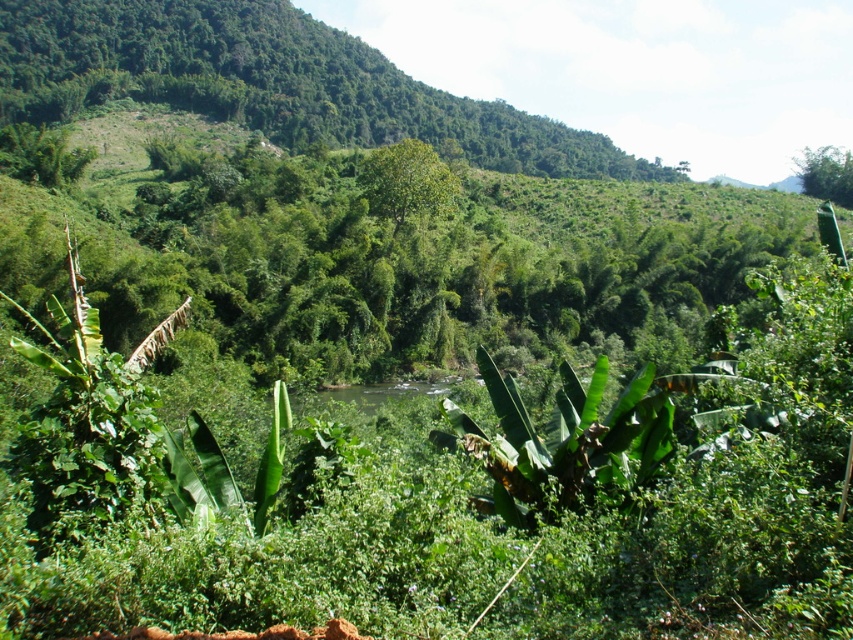
Is point (598, 465) farther from camera compared to point (440, 168)?

No, (598, 465) is closer to viewer.

The image size is (853, 640). Identify the location of green leafy banana tree at center. (564, 444).

Which is below, green leafy tree at center or green leafy tree at upper right?

green leafy tree at center

Between point (418, 202) and point (820, 163), which one is positioned behind?

Point (820, 163)

In order to click on green leafy tree at center in this screenshot , I will do `click(405, 180)`.

Consider the image. Which is above, green leafy banana tree at center or green leafy tree at upper right?

green leafy tree at upper right is higher up.

Is green leafy banana tree at center in front of green leafy tree at upper right?

Yes, it is.

Find the location of a particular element. green leafy banana tree at center is located at coordinates (564, 444).